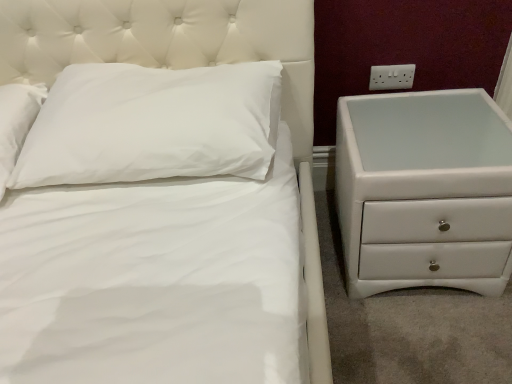
Question: Is white glossy chest of drawers at right aimed at white plastic electrical outlet at upper right?

Choices:
 (A) no
 (B) yes

Answer: (A)

Question: Is white glossy chest of drawers at right to the right of white plastic electrical outlet at upper right from the viewer's perspective?

Choices:
 (A) no
 (B) yes

Answer: (B)

Question: Does white glossy chest of drawers at right appear on the left side of white plastic electrical outlet at upper right?

Choices:
 (A) yes
 (B) no

Answer: (B)

Question: Considering the relative sizes of white glossy chest of drawers at right and white plastic electrical outlet at upper right in the image provided, is white glossy chest of drawers at right bigger than white plastic electrical outlet at upper right?

Choices:
 (A) no
 (B) yes

Answer: (B)

Question: Does white glossy chest of drawers at right touch white plastic electrical outlet at upper right?

Choices:
 (A) yes
 (B) no

Answer: (B)

Question: In the image, is white glossy chest of drawers at right positioned in front of or behind white plastic electrical outlet at upper right?

Choices:
 (A) behind
 (B) front

Answer: (B)

Question: From the image's perspective, relative to white plastic electrical outlet at upper right, is white glossy chest of drawers at right above or below?

Choices:
 (A) above
 (B) below

Answer: (B)

Question: Looking at the image, does white glossy chest of drawers at right seem bigger or smaller compared to white plastic electrical outlet at upper right?

Choices:
 (A) big
 (B) small

Answer: (A)

Question: From a real-world perspective, is white glossy chest of drawers at right physically located above or below white plastic electrical outlet at upper right?

Choices:
 (A) above
 (B) below

Answer: (B)

Question: Based on their positions, is white soft pillow at upper left located to the left or right of white glossy chest of drawers at right?

Choices:
 (A) right
 (B) left

Answer: (B)

Question: Considering the positions of white soft pillow at upper left and white glossy chest of drawers at right in the image, is white soft pillow at upper left wider or thinner than white glossy chest of drawers at right?

Choices:
 (A) thin
 (B) wide

Answer: (A)

Question: Is point (256, 74) positioned closer to the camera than point (456, 266)?

Choices:
 (A) farther
 (B) closer

Answer: (B)

Question: From a real-world perspective, is white soft pillow at upper left above or below white glossy chest of drawers at right?

Choices:
 (A) below
 (B) above

Answer: (B)

Question: Is white plastic electrical outlet at upper right wider or thinner than white soft pillow at upper left?

Choices:
 (A) wide
 (B) thin

Answer: (B)

Question: Visually, is white plastic electrical outlet at upper right positioned to the left or to the right of white soft pillow at upper left?

Choices:
 (A) right
 (B) left

Answer: (A)